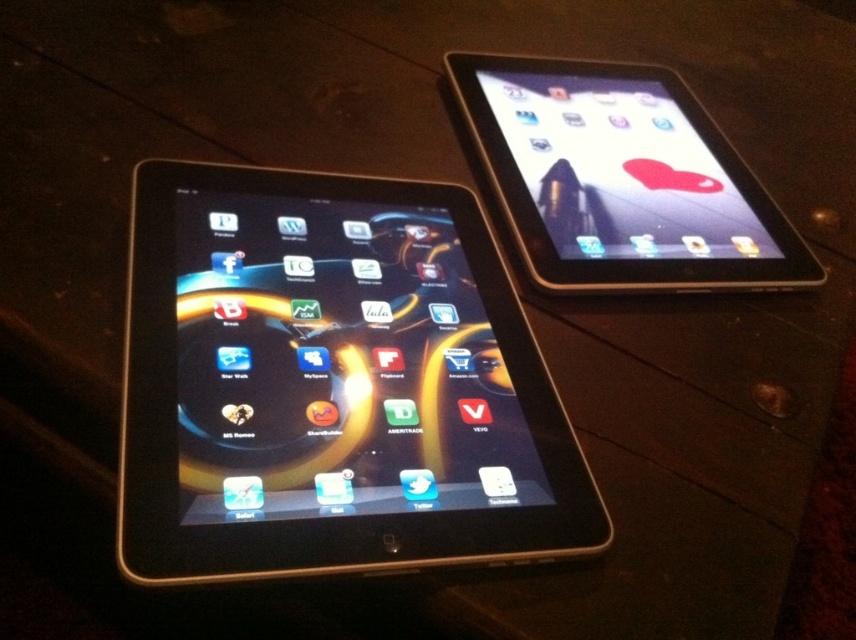
Question: Is black glossy tablet at left bigger than satin black tablet at upper right?

Choices:
 (A) no
 (B) yes

Answer: (B)

Question: Which point is closer to the camera?

Choices:
 (A) satin black tablet at upper right
 (B) black glossy tablet at left

Answer: (B)

Question: Observing the image, what is the correct spatial positioning of black glossy tablet at left in reference to satin black tablet at upper right?

Choices:
 (A) above
 (B) below

Answer: (B)

Question: Is black glossy tablet at left below satin black tablet at upper right?

Choices:
 (A) yes
 (B) no

Answer: (A)

Question: Which of the following is the farthest from the observer?

Choices:
 (A) (625, 232)
 (B) (510, 388)

Answer: (A)